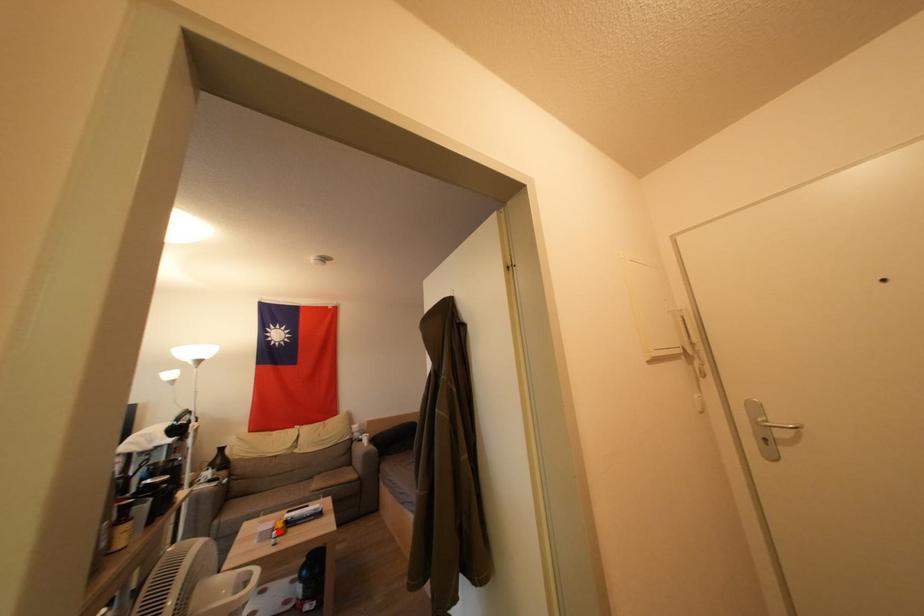
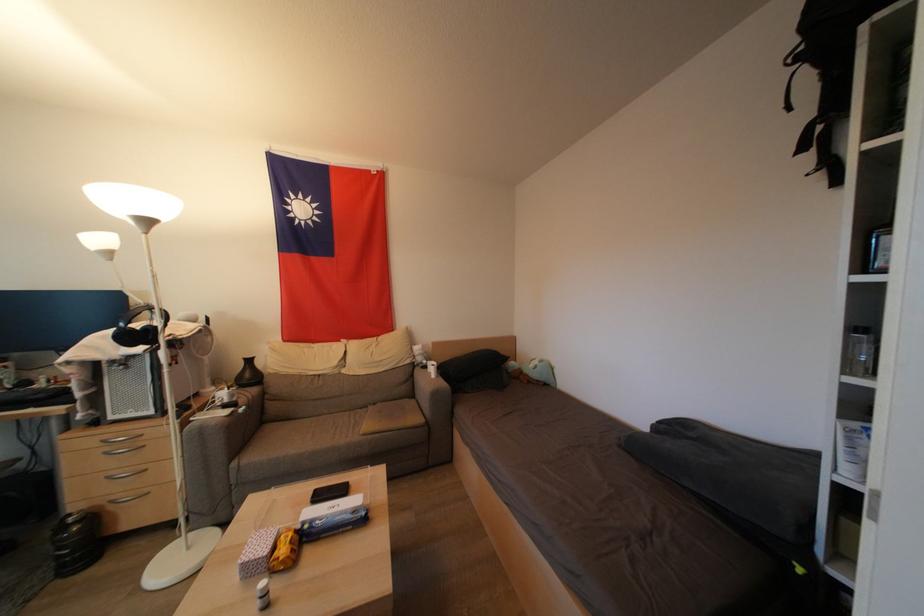
Where in the second image is the point corresponding to the highlighted location from the first image?

(277, 553)